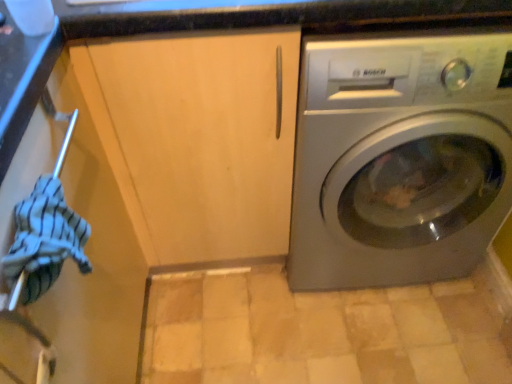
Question: Is matte wood cabinet at center at the right side of striped cotton towel at left?

Choices:
 (A) no
 (B) yes

Answer: (B)

Question: Can you confirm if matte wood cabinet at center is smaller than striped cotton towel at left?

Choices:
 (A) no
 (B) yes

Answer: (A)

Question: Is matte wood cabinet at center taller than striped cotton towel at left?

Choices:
 (A) yes
 (B) no

Answer: (A)

Question: Are matte wood cabinet at center and striped cotton towel at left far apart?

Choices:
 (A) yes
 (B) no

Answer: (B)

Question: Considering the relative sizes of matte wood cabinet at center and striped cotton towel at left in the image provided, is matte wood cabinet at center shorter than striped cotton towel at left?

Choices:
 (A) no
 (B) yes

Answer: (A)

Question: Is matte wood cabinet at center positioned before striped cotton towel at left?

Choices:
 (A) yes
 (B) no

Answer: (B)

Question: Is satin silver washing machine at right taller than matte wood cabinet at center?

Choices:
 (A) yes
 (B) no

Answer: (B)

Question: Can you confirm if satin silver washing machine at right is positioned to the left of matte wood cabinet at center?

Choices:
 (A) no
 (B) yes

Answer: (A)

Question: Can you confirm if satin silver washing machine at right is smaller than matte wood cabinet at center?

Choices:
 (A) no
 (B) yes

Answer: (A)

Question: Is matte wood cabinet at center at the back of satin silver washing machine at right?

Choices:
 (A) yes
 (B) no

Answer: (B)

Question: From the image's perspective, does satin silver washing machine at right appear lower than matte wood cabinet at center?

Choices:
 (A) yes
 (B) no

Answer: (B)

Question: From a real-world perspective, is satin silver washing machine at right over matte wood cabinet at center?

Choices:
 (A) yes
 (B) no

Answer: (B)

Question: Is striped cotton towel at left far away from satin silver washing machine at right?

Choices:
 (A) no
 (B) yes

Answer: (A)